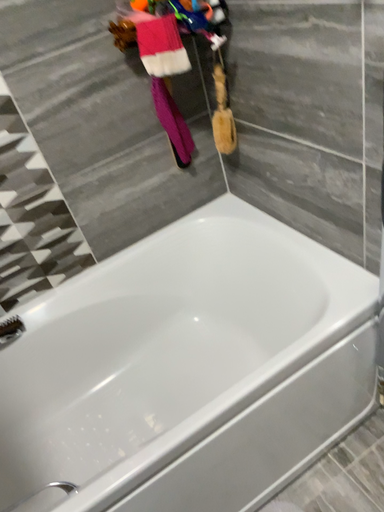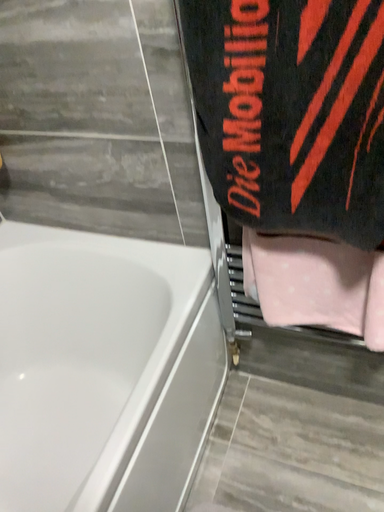
Question: How did the camera likely rotate when shooting the video?

Choices:
 (A) rotated left
 (B) rotated right

Answer: (B)